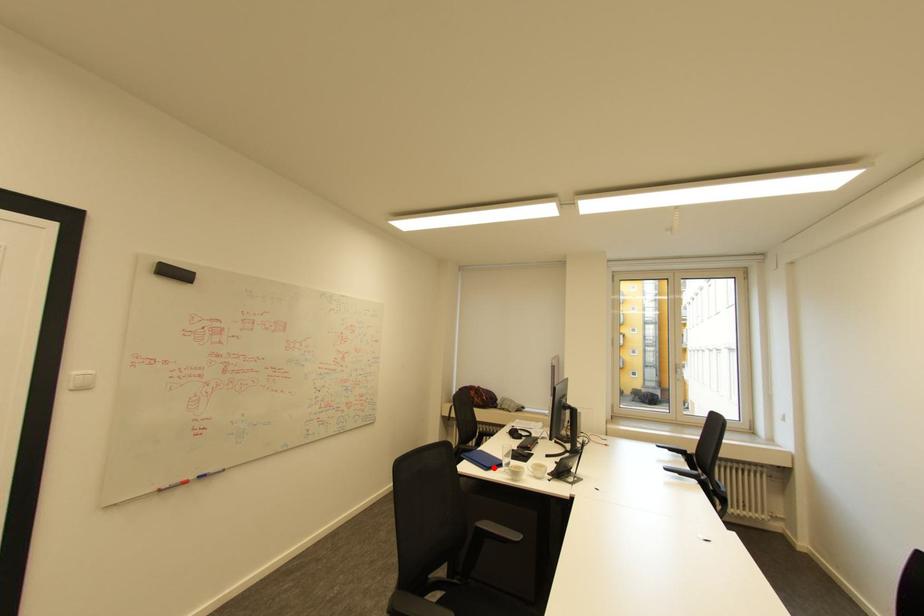
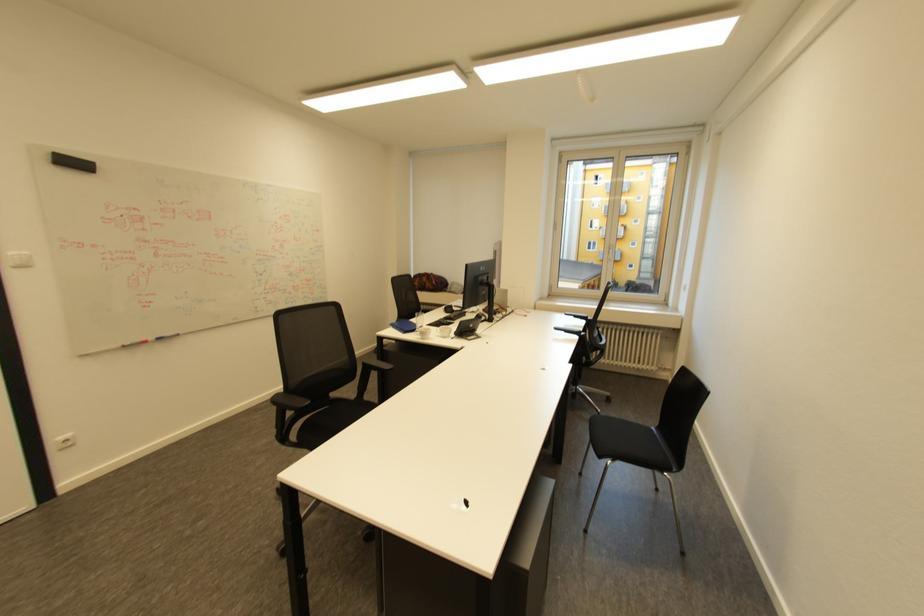
Question: I am providing you with two images of the same scene from different viewpoints. A red point is shown in image1. For the corresponding object point in image2, is it positioned nearer or farther from the camera?

Choices:
 (A) Nearer
 (B) Farther

Answer: (B)